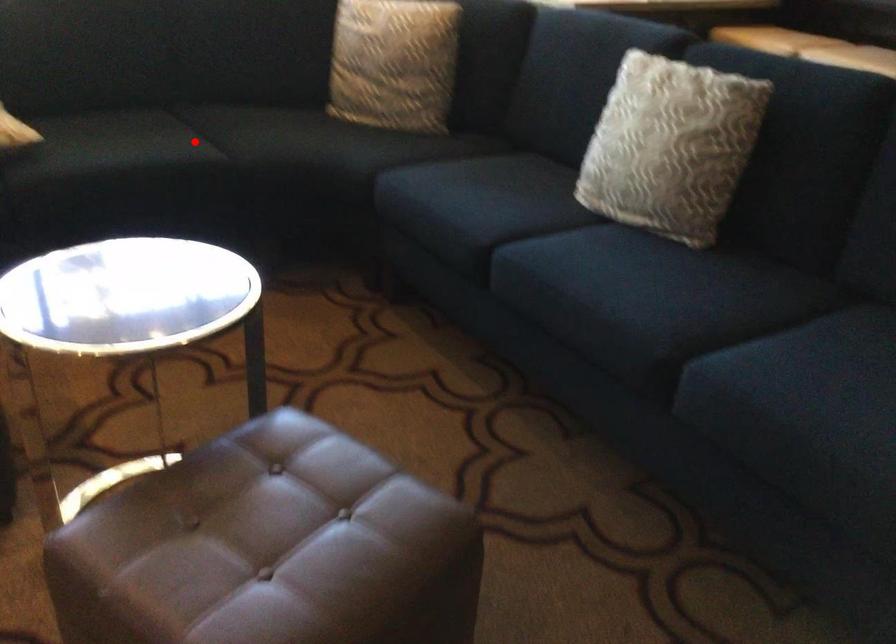
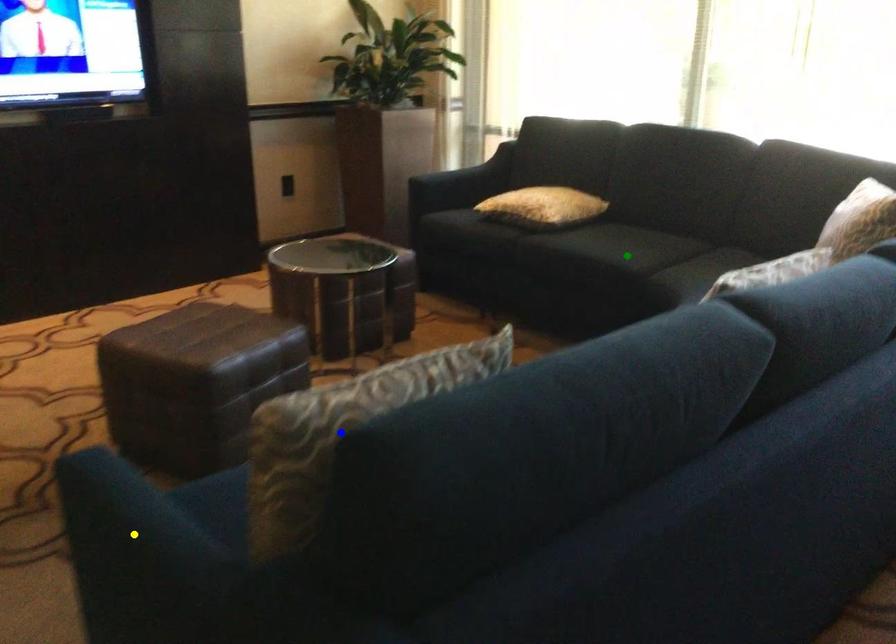
Question: I am providing you with two images of the same scene from different viewpoints. A red point is marked on the first image. You are given multiple points on the second image. Can you choose the point in image 2 that corresponds to the point in image 1?

Choices:
 (A) green point
 (B) blue point
 (C) yellow point

Answer: (A)